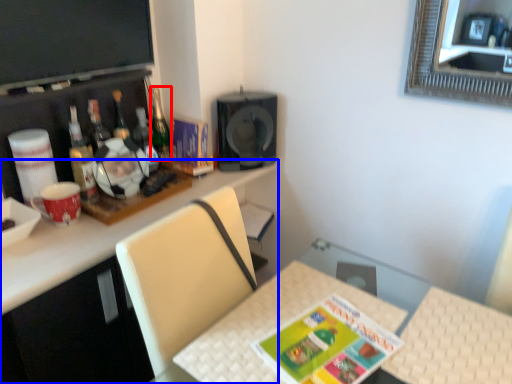
Question: Which object is closer to the camera taking this photo, bottle (highlighted by a red box) or desk (highlighted by a blue box)?

Choices:
 (A) bottle
 (B) desk

Answer: (B)